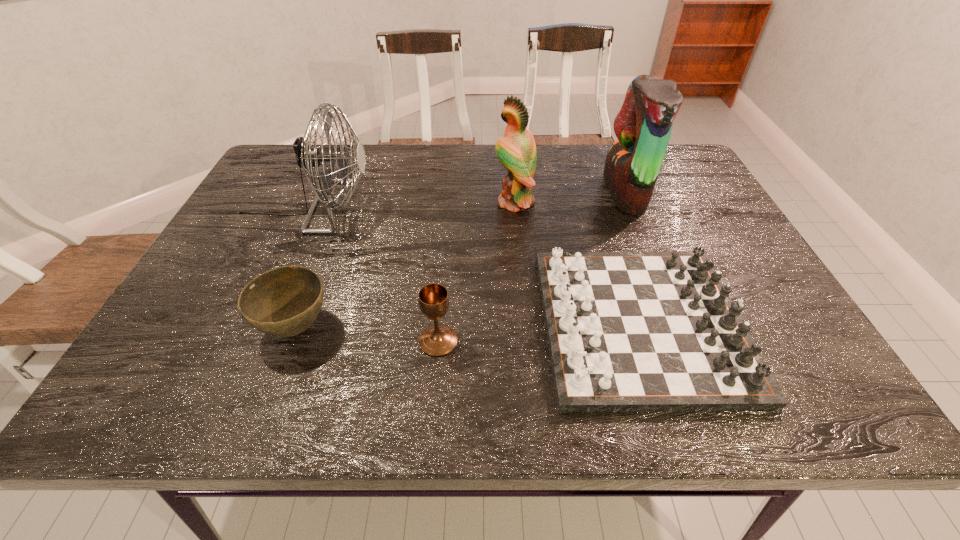
This screenshot has width=960, height=540. I want to click on vacant space that satisfies the following two spatial constraints: 1. on the back side of the bowl; 2. on the right side of the chessboard, so click(x=298, y=323).

Where is `vacant space that satisfies the following two spatial constraints: 1. on the front-facing side of the bowl; 2. on the right side of the fan`? vacant space that satisfies the following two spatial constraints: 1. on the front-facing side of the bowl; 2. on the right side of the fan is located at coordinates point(252,327).

I want to click on free spot that satisfies the following two spatial constraints: 1. on the back side of the chessboard; 2. on the left side of the third shortest object, so click(440, 323).

The height and width of the screenshot is (540, 960). What are the coordinates of `free space in the image that satisfies the following two spatial constraints: 1. on the back side of the bowl; 2. on the front-facing side of the fan` in the screenshot? It's located at (341, 206).